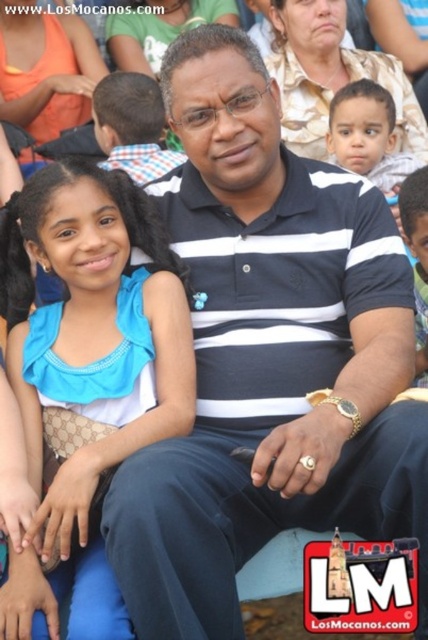
You are a photographer trying to capture a group photo of the smooth skin baby at upper right and the smooth skin face at center. Since you want both subjects to be in the frame, which direction should you move your camera to include both?

You should move the camera to the left because the smooth skin baby at upper right is positioned on the left side of smooth skin face at center, so shifting the camera left would ensure both are in frame.

You are taking a photo of the scene and want to focus on both the man and the girl. Given their positions at point (29, 602) and point (368, 97) respectively, which point should you adjust your focus to ensure both are in clear view?

Since point (29, 602) is closer to the camera than point (368, 97), you should focus on the closer point to ensure both are in clear view.

You are organizing a photo shoot and need to place the blue satin dress at left and the smooth skin baby at upper right in a way that maintains their original sizes. If the baby requires a space of 30 cm for comfort, what is the minimum width in centimeters the dress should occupy to ensure it is wider than the baby?

The blue satin dress at left is wider than the smooth skin baby at upper right. Since the baby needs 30 cm, the dress must be at least 30.1 cm wide to be wider.